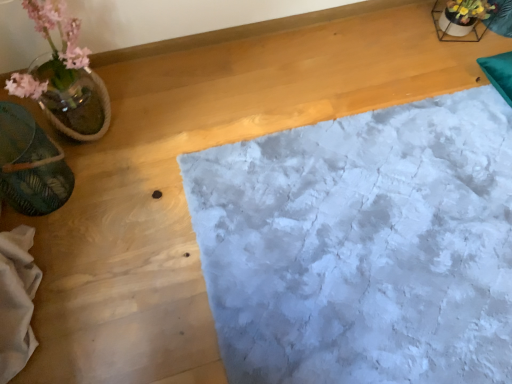
The height and width of the screenshot is (384, 512). What are the coordinates of `unoccupied region to the right of green leafy material at left` in the screenshot? It's located at (116, 198).